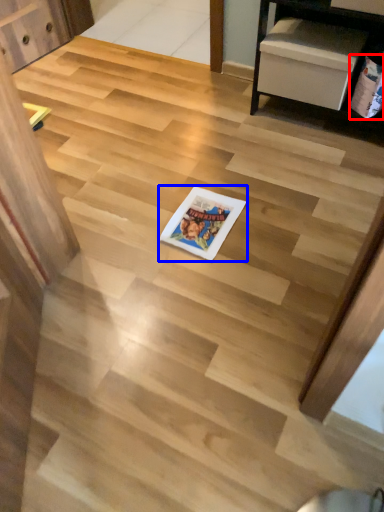
Question: Which object appears closest to the camera in this image, comic book (highlighted by a red box) or comic book (highlighted by a blue box)?

Choices:
 (A) comic book
 (B) comic book

Answer: (B)